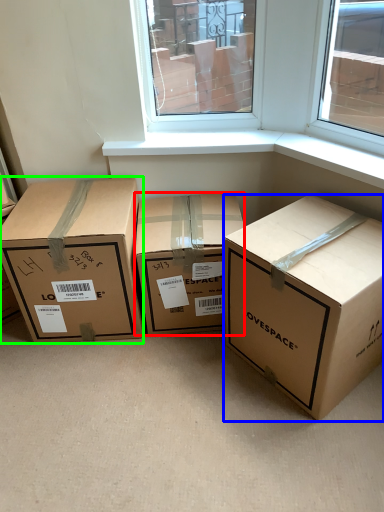
Question: Considering the real-world distances, which object is closest to box (highlighted by a red box)? box (highlighted by a blue box) or box (highlighted by a green box).

Choices:
 (A) box
 (B) box

Answer: (B)